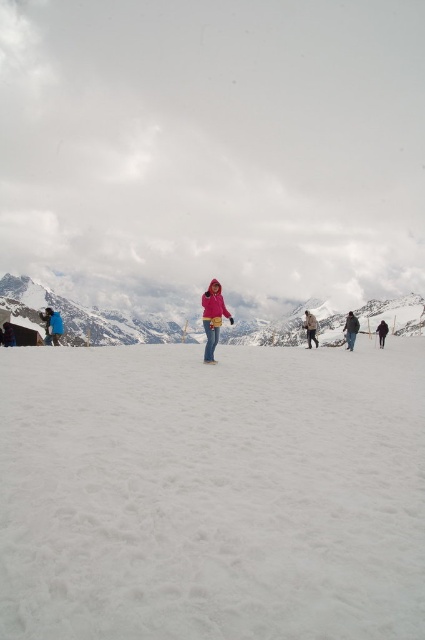
Which of these two, pink fleece jacket at center or dark gray jacket at right, stands shorter?

dark gray jacket at right is shorter.

This screenshot has height=640, width=425. In order to click on pink fleece jacket at center in this screenshot , I will do `click(212, 317)`.

Image resolution: width=425 pixels, height=640 pixels. What do you see at coordinates (212, 317) in the screenshot?
I see `pink fleece jacket at center` at bounding box center [212, 317].

This screenshot has width=425, height=640. Identify the location of pink fleece jacket at center. (212, 317).

Is white snow at center smaller than dark blue jeans at center?

No.

Is point (244, 595) farther from viewer compared to point (354, 333)?

No, (244, 595) is in front of (354, 333).

Measure the distance between point (158, 369) and camera.

They are 59.43 meters apart.

What are the coordinates of `white snow at center` in the screenshot? It's located at (212, 493).

The height and width of the screenshot is (640, 425). Describe the element at coordinates (212, 493) in the screenshot. I see `white snow at center` at that location.

The width and height of the screenshot is (425, 640). In order to click on white snow at center in this screenshot , I will do `click(212, 493)`.